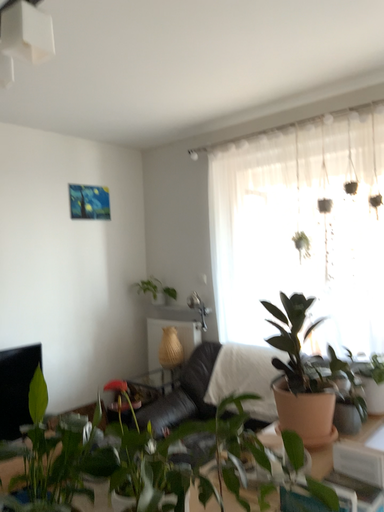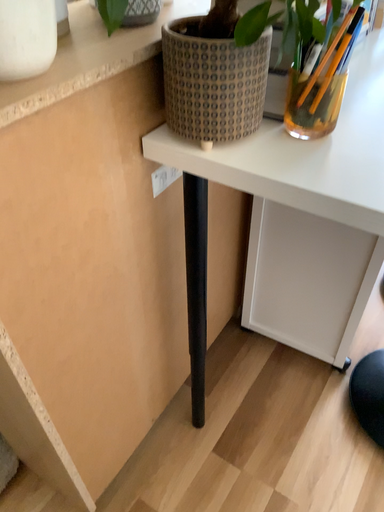
Question: How did the camera likely rotate when shooting the video?

Choices:
 (A) rotated upward
 (B) rotated downward

Answer: (B)